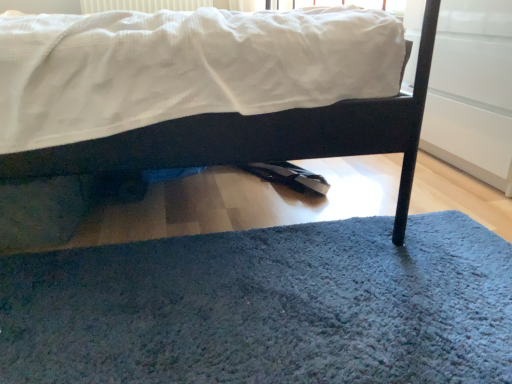
Question: Based on their positions, is blue shaggy rug at lower center located to the left or right of matte black bed at center?

Choices:
 (A) left
 (B) right

Answer: (B)

Question: Relative to matte black bed at center, is blue shaggy rug at lower center in front or behind?

Choices:
 (A) behind
 (B) front

Answer: (B)

Question: Considering the positions of blue shaggy rug at lower center and matte black bed at center in the image, is blue shaggy rug at lower center bigger or smaller than matte black bed at center?

Choices:
 (A) small
 (B) big

Answer: (A)

Question: Looking at the image, does matte black bed at center seem bigger or smaller compared to blue shaggy rug at lower center?

Choices:
 (A) big
 (B) small

Answer: (A)

Question: Is matte black bed at center in front of or behind blue shaggy rug at lower center in the image?

Choices:
 (A) behind
 (B) front

Answer: (A)

Question: In terms of height, does matte black bed at center look taller or shorter compared to blue shaggy rug at lower center?

Choices:
 (A) tall
 (B) short

Answer: (A)

Question: From the image's perspective, is matte black bed at center positioned above or below blue shaggy rug at lower center?

Choices:
 (A) above
 (B) below

Answer: (A)